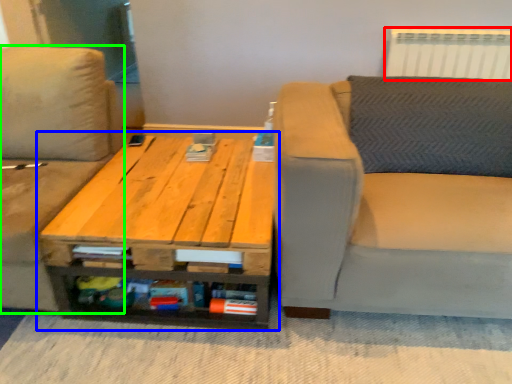
Question: Considering the real-world distances, which object is closest to radiator (highlighted by a red box)? table (highlighted by a blue box) or studio couch (highlighted by a green box).

Choices:
 (A) table
 (B) studio couch

Answer: (A)